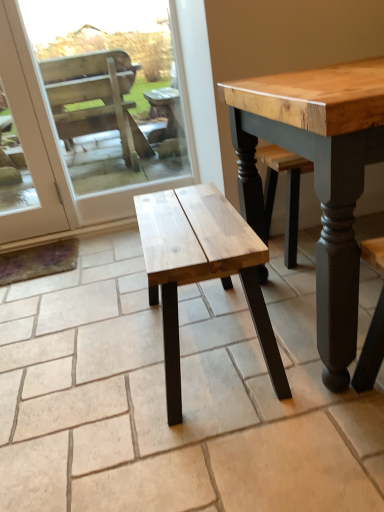
The image size is (384, 512). Identify the location of free space in front of natural wood bench at center. (223, 448).